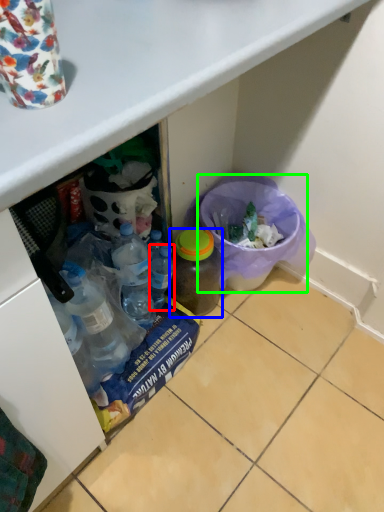
Question: Estimate the real-world distances between objects in this image. Which object is closer to bottle (highlighted by a red box), bottle (highlighted by a blue box) or recycling bin (highlighted by a green box)?

Choices:
 (A) bottle
 (B) recycling bin

Answer: (A)